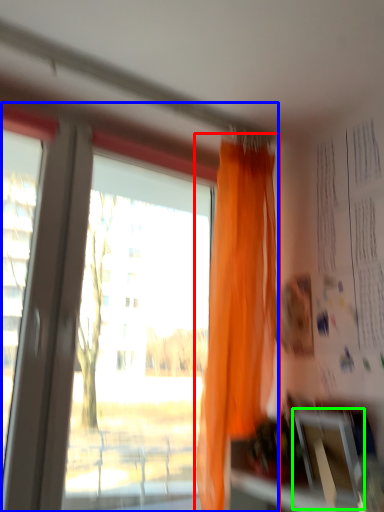
Question: Based on their relative distances, which object is farther from curtain (highlighted by a red box)? Choose from window (highlighted by a blue box) and window screen (highlighted by a green box).

Choices:
 (A) window
 (B) window screen

Answer: (A)